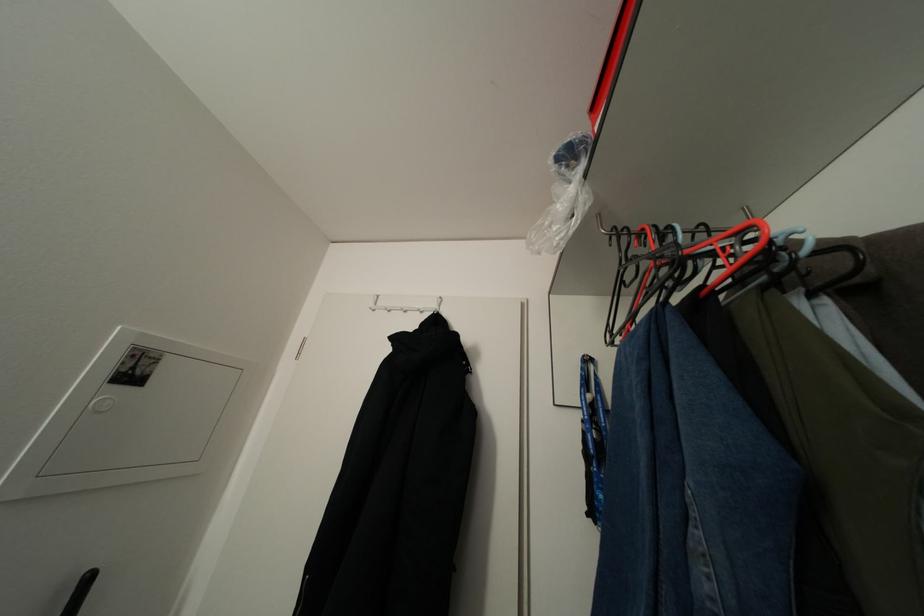
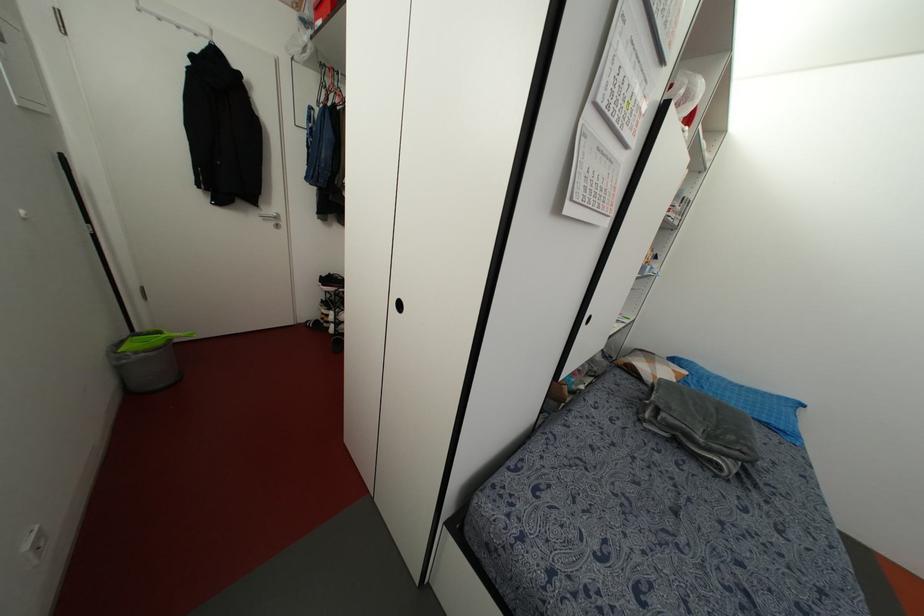
In the second image, find the point that corresponds to [616,232] in the first image.

(322, 63)